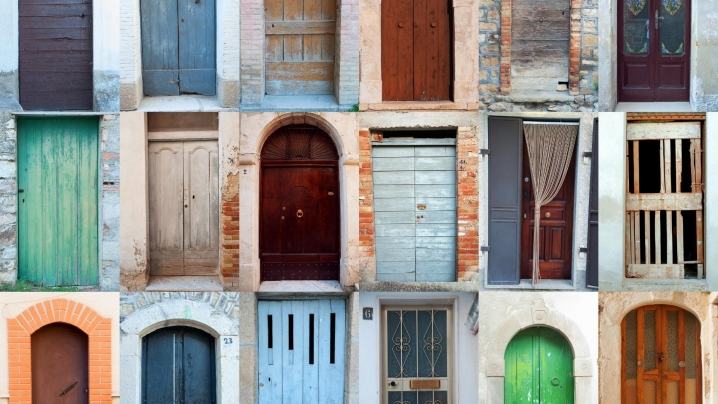
This screenshot has width=718, height=404. I want to click on doors toward the left, so click(45, 39), click(164, 35), click(179, 195), click(46, 185), click(57, 351), click(182, 361).